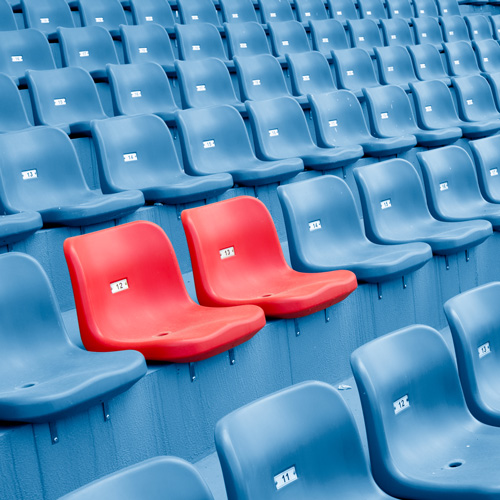
The height and width of the screenshot is (500, 500). What are the coordinates of `chairs in the row with red chairs` in the screenshot? It's located at (38, 334), (135, 286), (232, 244), (342, 225), (411, 200), (452, 176), (493, 159).